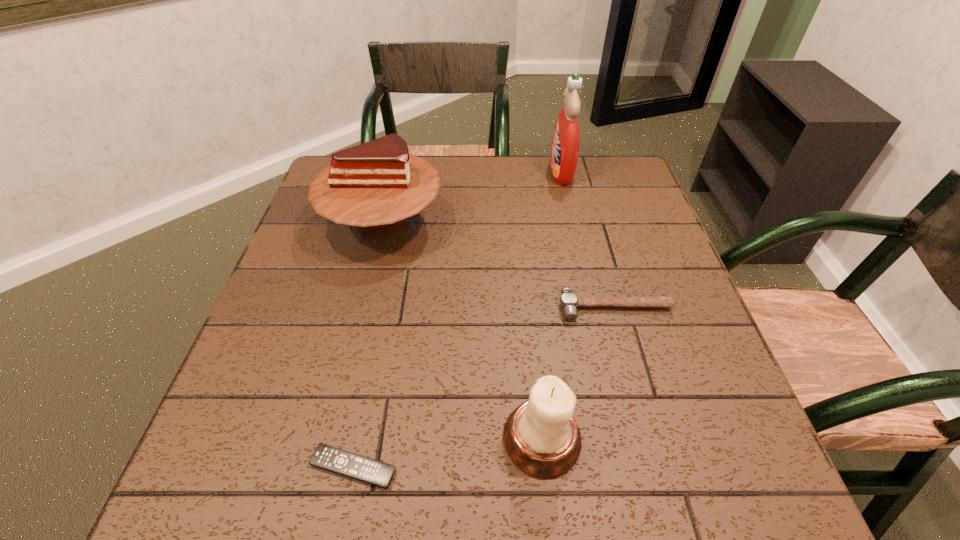
Where is `detergent`? This screenshot has height=540, width=960. detergent is located at coordinates (566, 138).

This screenshot has width=960, height=540. Identify the location of the farthest object. tap(566, 138).

At what (x,y) coordinates should I click in order to perform the action: click on the second tallest object. Please return your answer as a coordinate pair (x, y). This screenshot has width=960, height=540. Looking at the image, I should click on (375, 186).

Where is `the second farthest object`? The image size is (960, 540). the second farthest object is located at coordinates (375, 186).

The height and width of the screenshot is (540, 960). In order to click on the third object from right to left in this screenshot , I will do `click(541, 437)`.

Find the location of a particular element. The image size is (960, 540). candle holder is located at coordinates (541, 437).

Find the location of a particular element. This screenshot has width=960, height=540. hammer is located at coordinates (568, 301).

Identify the location of the third nearest object. The height and width of the screenshot is (540, 960). (568, 301).

Where is `the shortest object`? This screenshot has width=960, height=540. the shortest object is located at coordinates (349, 464).

At what (x,y) coordinates should I click in order to perform the action: click on free location located on the front surface of the tallest object. Please return your answer as a coordinate pair (x, y). The height and width of the screenshot is (540, 960). Looking at the image, I should click on (468, 172).